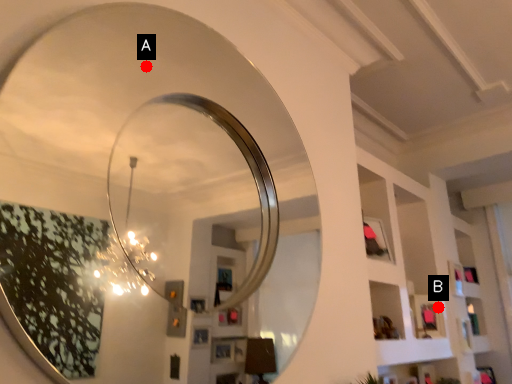
Question: Two points are circled on the image, labeled by A and B beside each circle. Which of the following is the closest to the observer?

Choices:
 (A) A is closer
 (B) B is closer

Answer: (A)